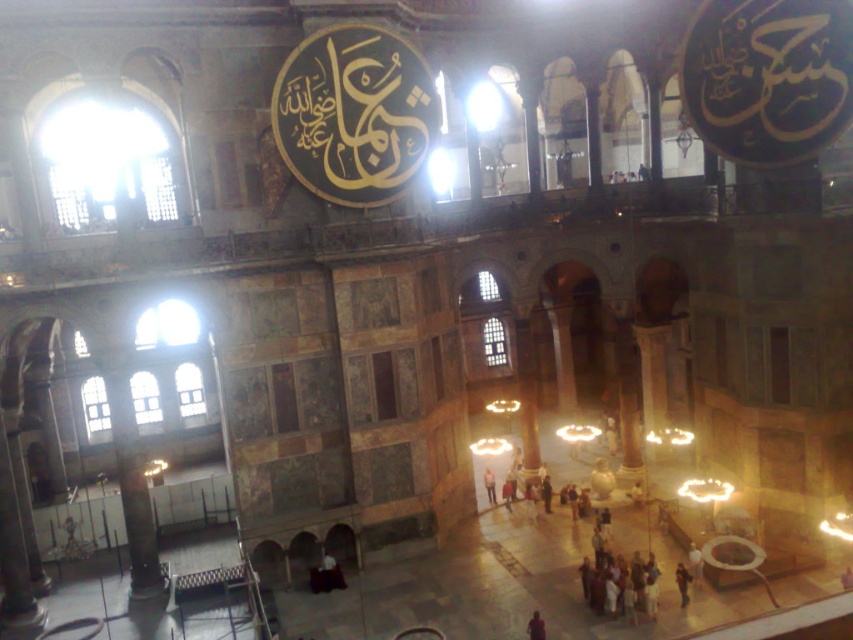
Question: Is dark brown leather jacket at lower center positioned before dark brown leather jacket at center?

Choices:
 (A) yes
 (B) no

Answer: (B)

Question: Is dark brown leather jacket at lower center in front of light brown leather jacket at center?

Choices:
 (A) no
 (B) yes

Answer: (B)

Question: Which point is farther to the camera?

Choices:
 (A) (142, 552)
 (B) (686, 584)
 (C) (491, 497)
 (D) (537, 611)

Answer: (C)

Question: Does polished marble pillar at lower left have a larger size compared to dark brown leather jacket at center?

Choices:
 (A) no
 (B) yes

Answer: (B)

Question: Which point is closer to the camera taking this photo?

Choices:
 (A) (535, 632)
 (B) (138, 554)
 (C) (488, 486)

Answer: (A)

Question: Among these points, which one is nearest to the camera?

Choices:
 (A) [685, 605]
 (B) [544, 634]

Answer: (B)